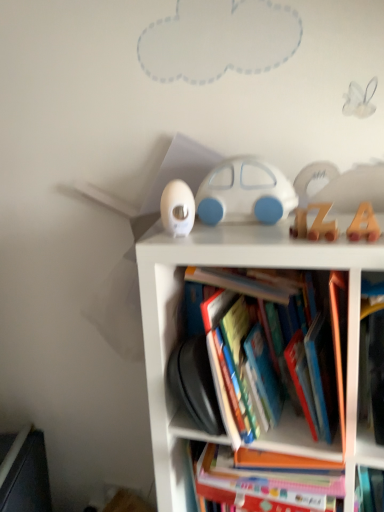
What are the coordinates of `vacant area that is in front of white matte car at center, positioned as the first toy in back-to-front order` in the screenshot? It's located at (235, 236).